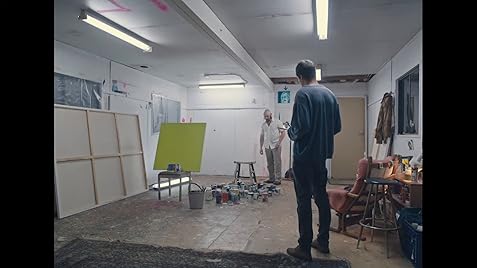
Locate an element on the screen. The height and width of the screenshot is (268, 477). chair is located at coordinates (345, 200).